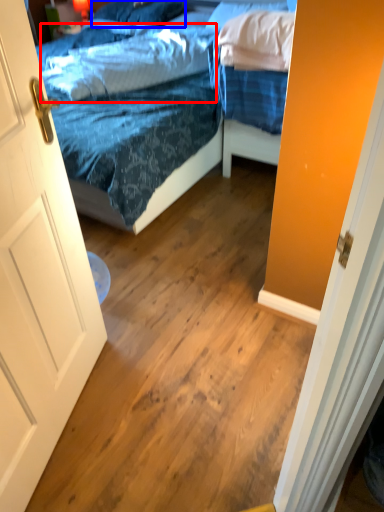
Question: Which point is closer to the camera, pillow (highlighted by a red box) or pillow (highlighted by a blue box)?

Choices:
 (A) pillow
 (B) pillow

Answer: (A)